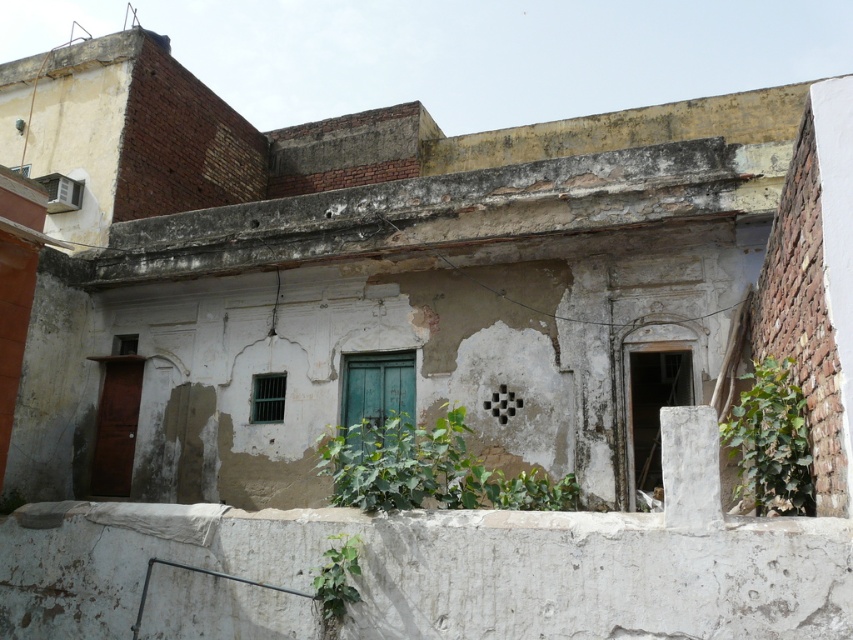
Question: Which object is the closest to the green leafy plant at right?

Choices:
 (A) green leafy plant at center
 (B) green leafy plant at lower center

Answer: (B)

Question: Considering the real-world distances, which object is farthest from the green leafy plant at right?

Choices:
 (A) green leafy plant at center
 (B) green leafy plant at lower center

Answer: (A)

Question: Is green leafy plant at center closer to the viewer compared to green leafy plant at right?

Choices:
 (A) no
 (B) yes

Answer: (A)

Question: Among these objects, which one is farthest from the camera?

Choices:
 (A) green leafy plant at center
 (B) green leafy plant at lower center

Answer: (A)

Question: Is green leafy plant at right thinner than green leafy plant at lower center?

Choices:
 (A) yes
 (B) no

Answer: (B)

Question: Does green leafy plant at center have a lesser width compared to green leafy plant at lower center?

Choices:
 (A) no
 (B) yes

Answer: (A)